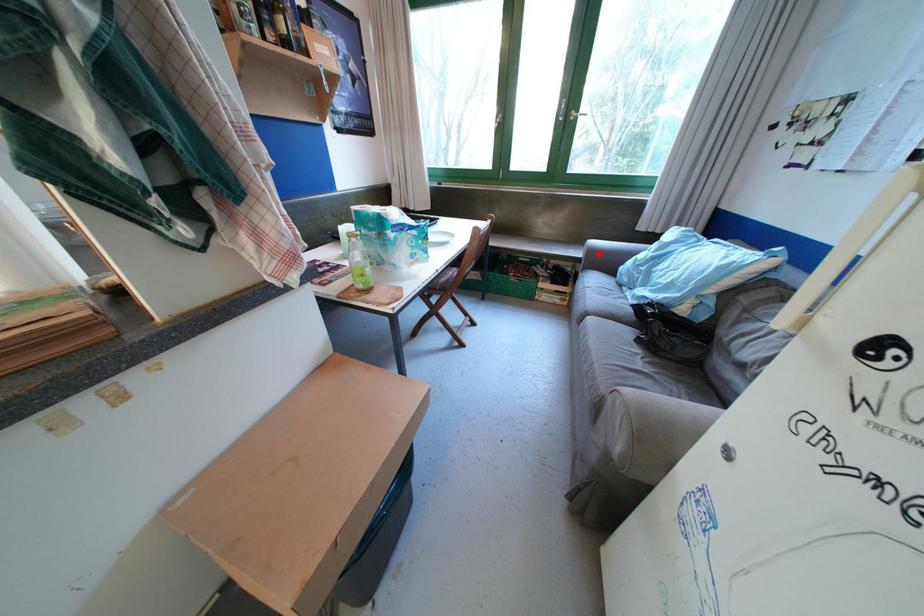
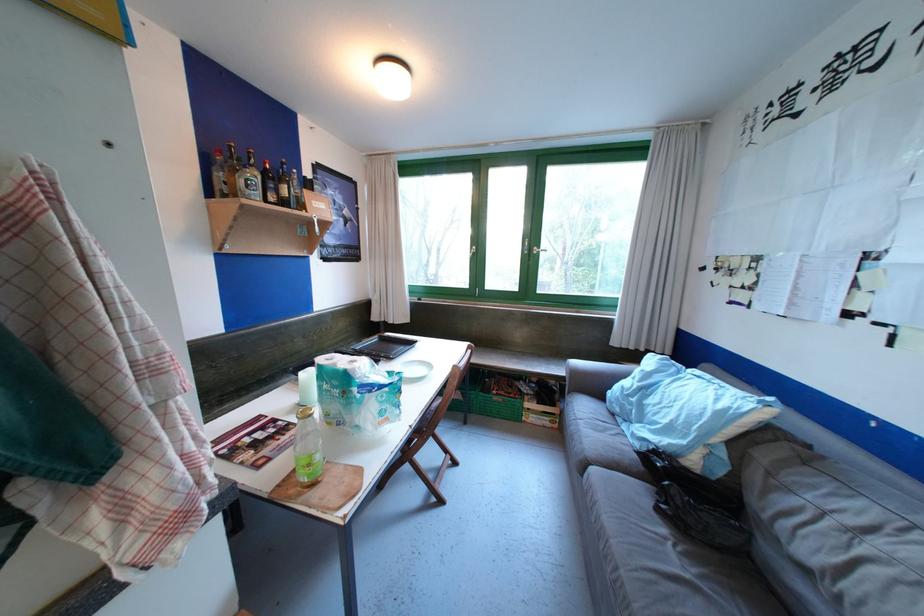
Where in the second image is the point corresponding to the highlighted location from the first image?

(581, 376)